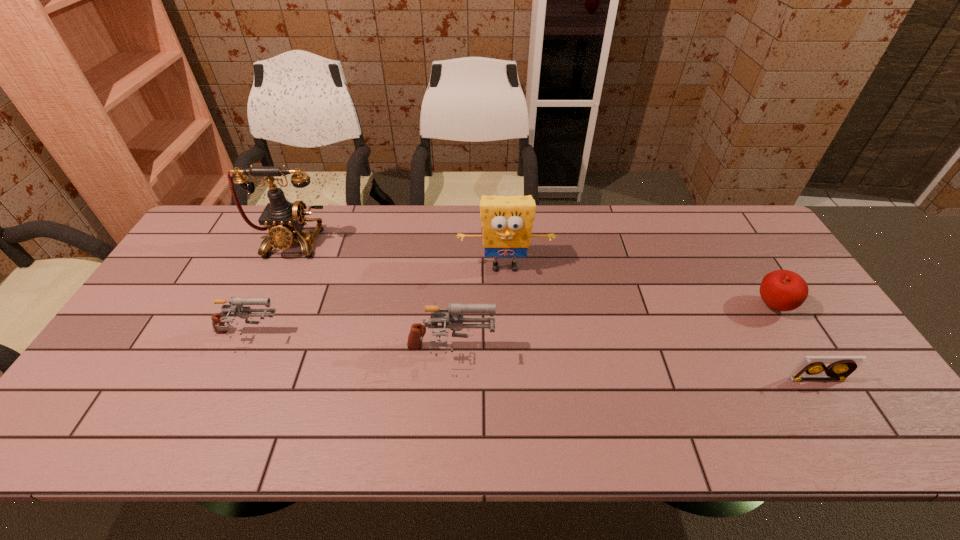
The image size is (960, 540). Find the location of `the left gun`. the left gun is located at coordinates (236, 306).

Find the location of a particular element. The width and height of the screenshot is (960, 540). the taller gun is located at coordinates (454, 322).

Where is `the fourth shortest object`? Image resolution: width=960 pixels, height=540 pixels. the fourth shortest object is located at coordinates click(x=454, y=322).

The image size is (960, 540). I want to click on telephone, so click(285, 220).

The height and width of the screenshot is (540, 960). What are the coordinates of `apple` in the screenshot? It's located at (782, 290).

Find the location of `sponge`. sponge is located at coordinates (507, 221).

Locate an element on the screen. This screenshot has height=540, width=960. the shortest object is located at coordinates (813, 367).

Find the location of a particular element. the nearest object is located at coordinates (813, 367).

Where is `vacant space situated at the barrel end of the left gun`? The height and width of the screenshot is (540, 960). vacant space situated at the barrel end of the left gun is located at coordinates (356, 335).

The image size is (960, 540). Find the location of `vacant region located 0.230m at the barrel end of the third tallest object`. vacant region located 0.230m at the barrel end of the third tallest object is located at coordinates (584, 352).